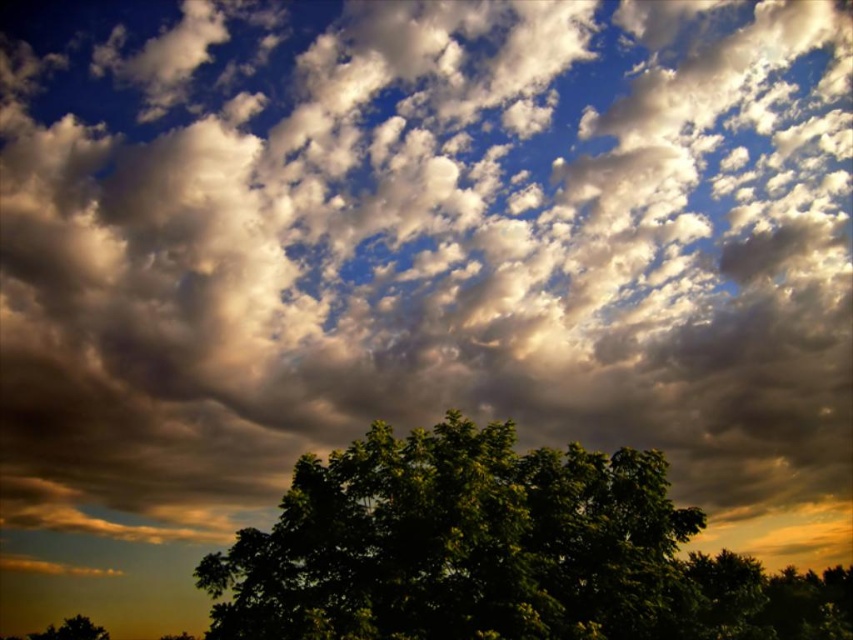
Question: Which point is closer to the camera taking this photo?

Choices:
 (A) (84, 637)
 (B) (244, 605)

Answer: (B)

Question: Can you confirm if green leafy tree at center is thinner than green leafy tree at lower center?

Choices:
 (A) yes
 (B) no

Answer: (B)

Question: Does green leafy tree at center appear over green leafy tree at lower center?

Choices:
 (A) yes
 (B) no

Answer: (A)

Question: Among these objects, which one is nearest to the camera?

Choices:
 (A) green leafy tree at center
 (B) green leafy tree at lower center

Answer: (A)

Question: Can you confirm if green leafy tree at center is smaller than green leafy tree at lower center?

Choices:
 (A) yes
 (B) no

Answer: (B)